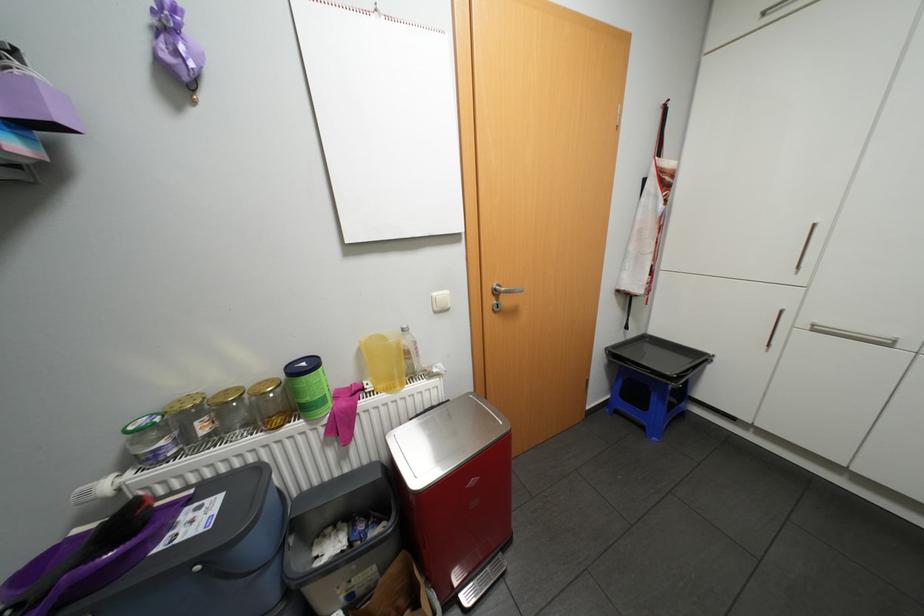
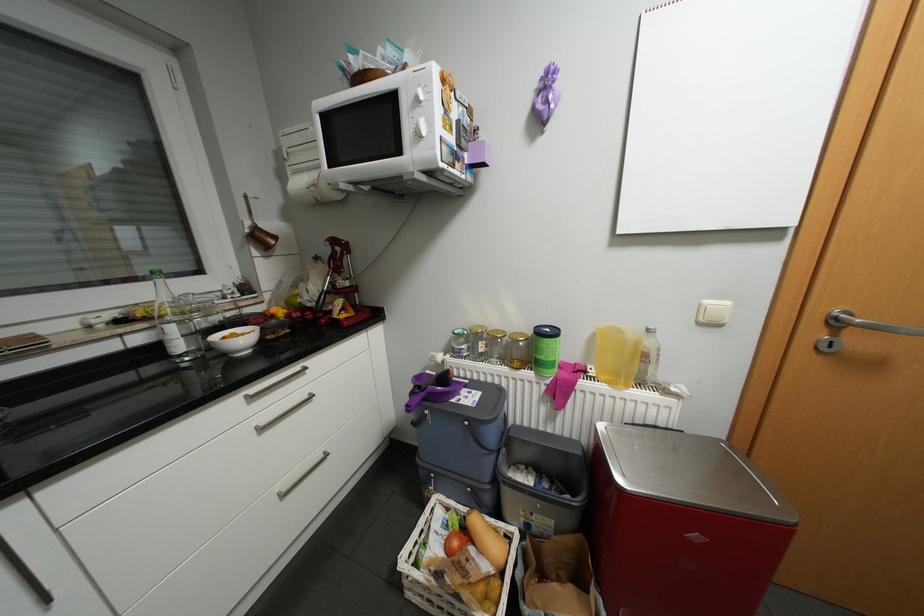
Where in the second image is the point corresponding to (314,419) from the first image?

(544, 373)